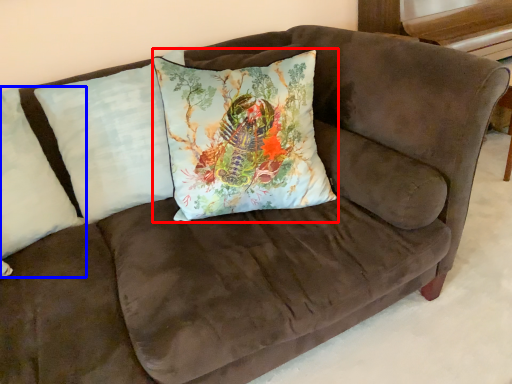
Question: Which object is closer to the camera taking this photo, pillow (highlighted by a red box) or pillow (highlighted by a blue box)?

Choices:
 (A) pillow
 (B) pillow

Answer: (B)